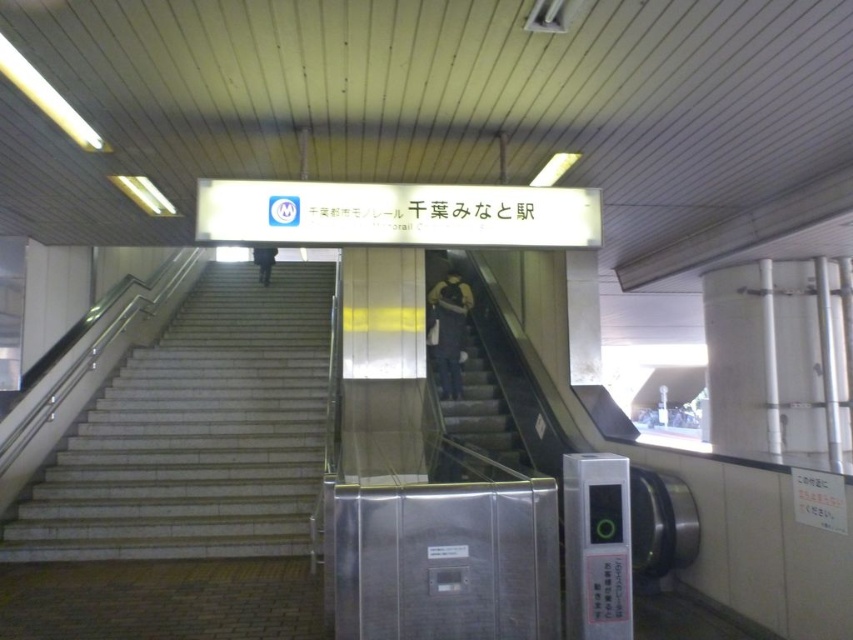
Question: Among these objects, which one is nearest to the camera?

Choices:
 (A) dark blue jeans at center
 (B) white marble stairs at center
 (C) dark blue jeans at upper center
 (D) gray concrete stairs at center

Answer: (D)

Question: Considering the real-world distances, which object is farthest from the gray concrete stairs at center?

Choices:
 (A) dark blue jeans at center
 (B) dark blue jeans at upper center

Answer: (B)

Question: Is gray concrete stairs at center to the right of dark blue jeans at center from the viewer's perspective?

Choices:
 (A) no
 (B) yes

Answer: (B)

Question: Is the position of dark blue jeans at center less distant than that of dark blue jeans at upper center?

Choices:
 (A) no
 (B) yes

Answer: (B)

Question: Does gray concrete stairs at center have a lesser width compared to dark blue jeans at upper center?

Choices:
 (A) no
 (B) yes

Answer: (A)

Question: Which of these objects is positioned closest to the dark blue jeans at center?

Choices:
 (A) gray concrete stairs at center
 (B) dark blue jeans at upper center

Answer: (A)